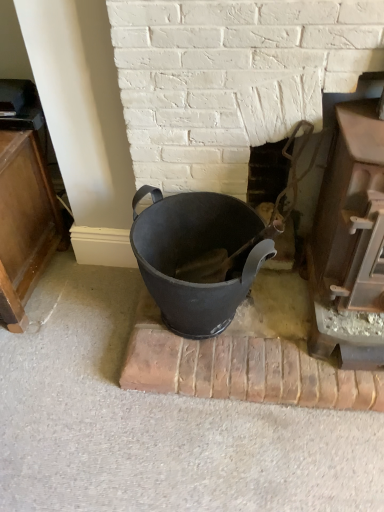
Identify the location of vacant area that lies between smooth brown wood at right, which ranks as the 3th fireplace in left-to-right order, and smooth metal fireplace at center, marked as the second fireplace in a right-to-left arrangement. The height and width of the screenshot is (512, 384). (291, 322).